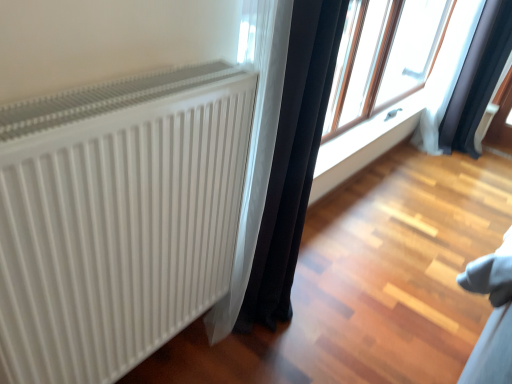
Question: Is black fabric curtain at center, the second curtain from the back, not near transparent glass window at upper right?

Choices:
 (A) yes
 (B) no

Answer: (A)

Question: Does black fabric curtain at center, the second curtain from the back, have a greater height compared to transparent glass window at upper right?

Choices:
 (A) yes
 (B) no

Answer: (A)

Question: From a real-world perspective, is black fabric curtain at center, marked as the second curtain in a right-to-left arrangement, on transparent glass window at upper right?

Choices:
 (A) yes
 (B) no

Answer: (B)

Question: Considering the relative positions of black fabric curtain at center, acting as the first curtain starting from the left, and transparent glass window at upper right in the image provided, is black fabric curtain at center, acting as the first curtain starting from the left, to the right of transparent glass window at upper right from the viewer's perspective?

Choices:
 (A) yes
 (B) no

Answer: (B)

Question: Could you tell me if black fabric curtain at center, marked as the second curtain in a right-to-left arrangement, is facing transparent glass window at upper right?

Choices:
 (A) yes
 (B) no

Answer: (B)

Question: Does black fabric curtain at center, acting as the first curtain starting from the front, have a greater width compared to transparent glass window at upper right?

Choices:
 (A) no
 (B) yes

Answer: (B)

Question: Is black fabric curtain at center, marked as the second curtain in a right-to-left arrangement, not within black fabric curtain at upper right, which ranks as the 1th curtain in back-to-front order?

Choices:
 (A) no
 (B) yes

Answer: (B)

Question: Considering the relative sizes of black fabric curtain at center, the second curtain from the back, and black fabric curtain at upper right, the 2th curtain in the left-to-right sequence, in the image provided, is black fabric curtain at center, the second curtain from the back, shorter than black fabric curtain at upper right, the 2th curtain in the left-to-right sequence,?

Choices:
 (A) yes
 (B) no

Answer: (B)

Question: Are black fabric curtain at center, marked as the second curtain in a right-to-left arrangement, and black fabric curtain at upper right, positioned as the second curtain in front-to-back order, located far from each other?

Choices:
 (A) yes
 (B) no

Answer: (A)

Question: From the image's perspective, is black fabric curtain at center, acting as the first curtain starting from the front, beneath black fabric curtain at upper right, the 1th curtain positioned from the right?

Choices:
 (A) no
 (B) yes

Answer: (B)

Question: Is black fabric curtain at center, acting as the first curtain starting from the left, in front of black fabric curtain at upper right, positioned as the second curtain in front-to-back order?

Choices:
 (A) no
 (B) yes

Answer: (B)

Question: Does black fabric curtain at center, the second curtain from the back, have a greater height compared to black fabric curtain at upper right, the 1th curtain positioned from the right?

Choices:
 (A) no
 (B) yes

Answer: (B)

Question: From a real-world perspective, is white ribbed radiator at left positioned under black fabric curtain at upper right, positioned as the second curtain in front-to-back order, based on gravity?

Choices:
 (A) yes
 (B) no

Answer: (B)